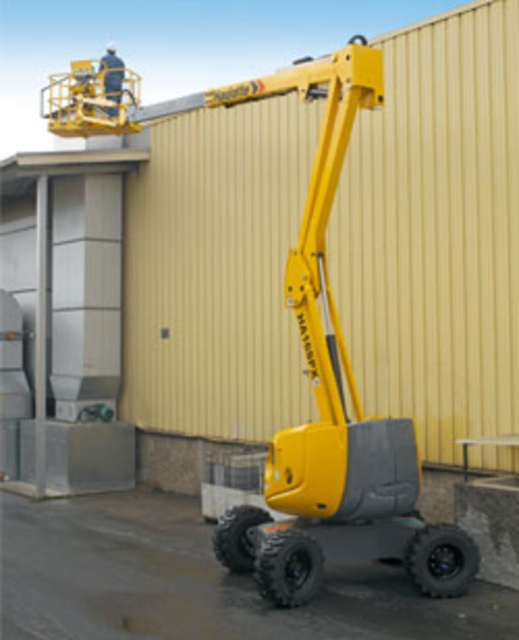
Question: Can you confirm if yellow matte forklift at center is positioned above white fabric construction worker at upper center?

Choices:
 (A) yes
 (B) no

Answer: (B)

Question: Which point is closer to the camera?

Choices:
 (A) white fabric construction worker at upper center
 (B) yellow matte forklift at center

Answer: (B)

Question: Which point is farther to the camera?

Choices:
 (A) (114, 74)
 (B) (310, 204)

Answer: (A)

Question: Does yellow matte forklift at center appear on the left side of white fabric construction worker at upper center?

Choices:
 (A) no
 (B) yes

Answer: (A)

Question: Which of the following is the closest to the observer?

Choices:
 (A) [x=353, y=380]
 (B) [x=114, y=58]

Answer: (A)

Question: Is yellow matte forklift at center above white fabric construction worker at upper center?

Choices:
 (A) yes
 (B) no

Answer: (B)